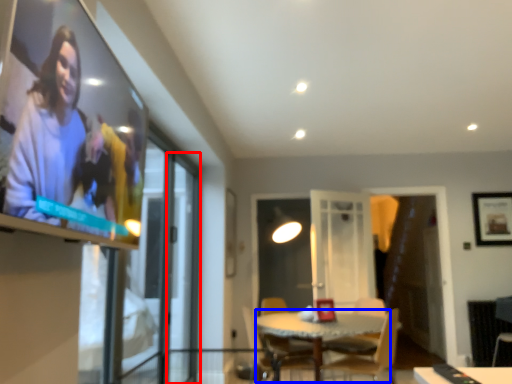
Question: Which of the following is the farthest to the observer, screen door (highlighted by a red box) or glass table (highlighted by a blue box)?

Choices:
 (A) screen door
 (B) glass table

Answer: (A)